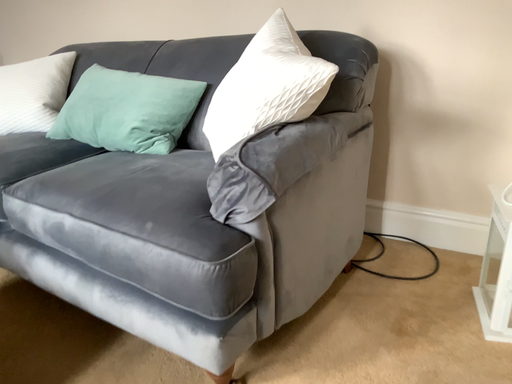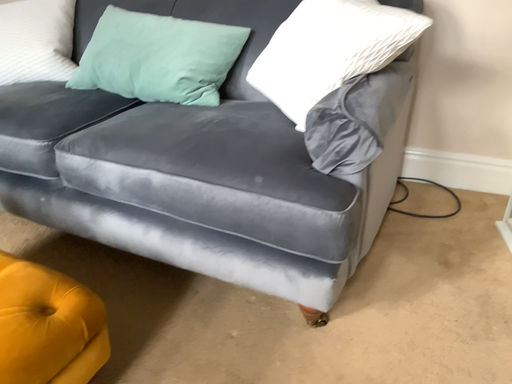
Question: Which way did the camera rotate in the video?

Choices:
 (A) rotated downward
 (B) rotated upward

Answer: (A)